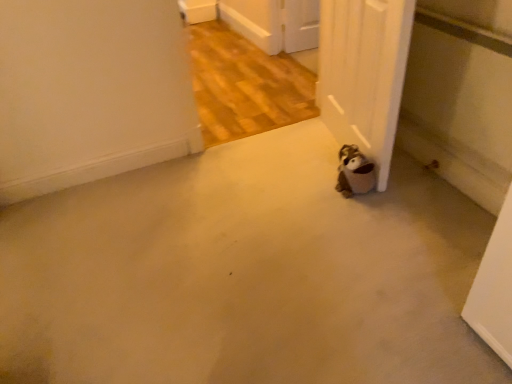
Find the location of a particular element. This screenshot has width=512, height=384. empty space that is in between white matte door at lower right and brown plush toy at lower right is located at coordinates coord(326,161).